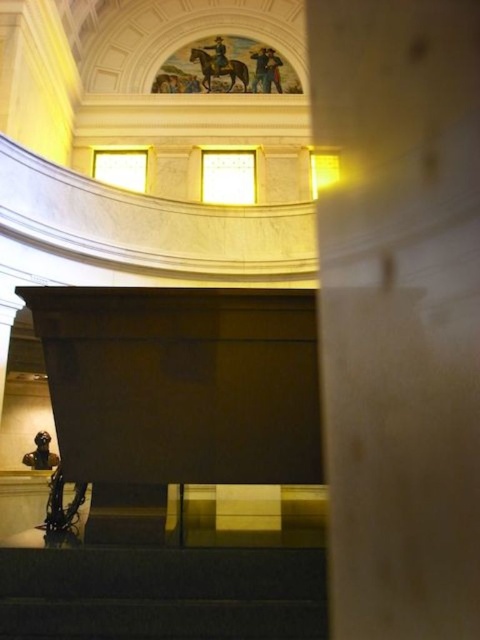
Which is above, blue fabric uniform at upper center or light brown leather horse at upper center?

light brown leather horse at upper center

What do you see at coordinates (272, 70) in the screenshot? I see `blue fabric uniform at upper center` at bounding box center [272, 70].

Image resolution: width=480 pixels, height=640 pixels. I want to click on blue fabric uniform at upper center, so 272,70.

The height and width of the screenshot is (640, 480). Describe the element at coordinates (399, 310) in the screenshot. I see `white marble pillar at center` at that location.

Can you confirm if white marble pillar at center is positioned above dark blue uniform at upper center?

No, white marble pillar at center is not above dark blue uniform at upper center.

Which is in front, point (372, 113) or point (262, 88)?

Point (372, 113)

Where is `white marble pillar at center`? white marble pillar at center is located at coordinates (399, 310).

From the picture: Who is shorter, dark blue uniform at upper center or light brown leather horse at upper center?

light brown leather horse at upper center is shorter.

Is point (264, 77) in front of point (215, 65)?

Yes, point (264, 77) is in front of point (215, 65).

Does point (263, 72) come closer to viewer compared to point (225, 65)?

Yes.

The width and height of the screenshot is (480, 640). I want to click on dark blue uniform at upper center, so click(x=260, y=68).